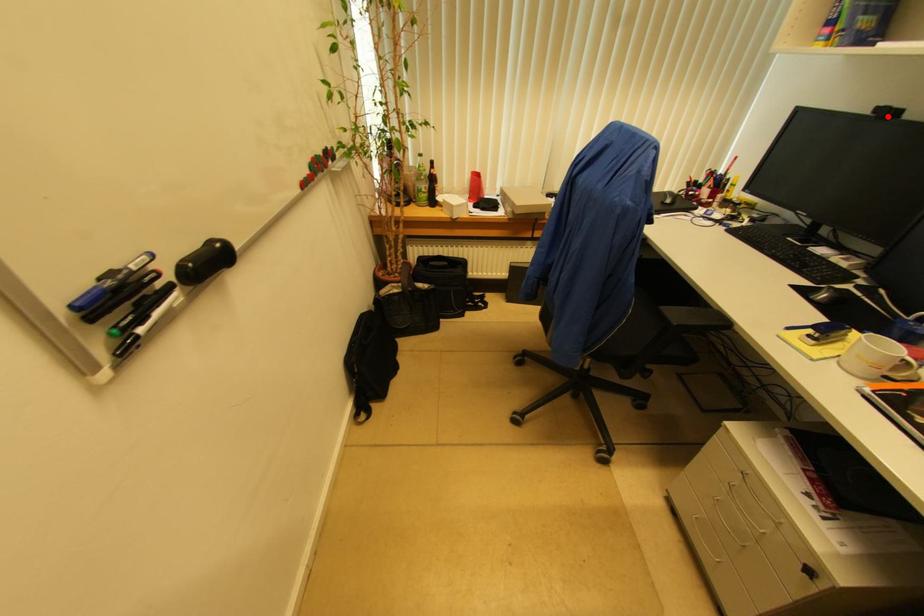
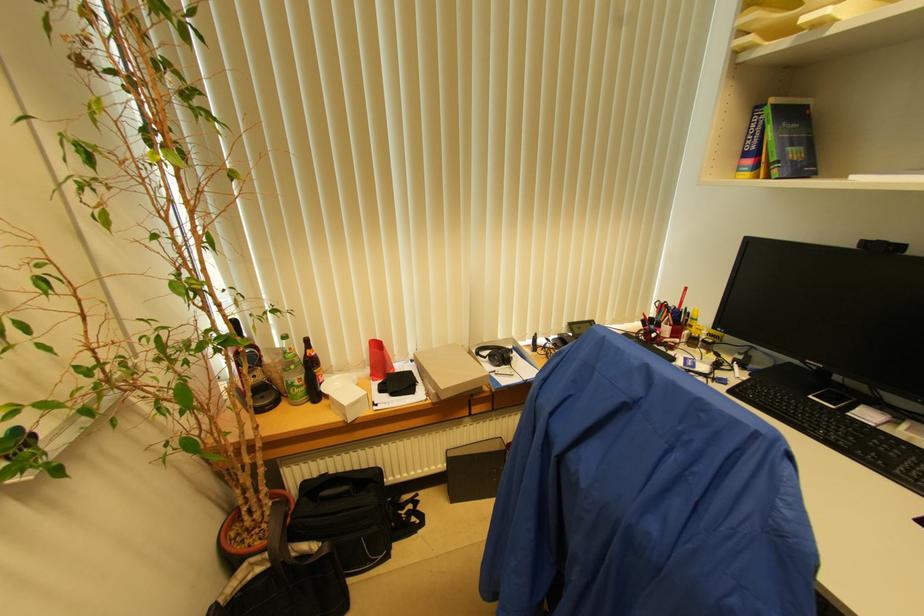
Find the pixel in the second image that matches the highlighted location in the first image.

(882, 251)